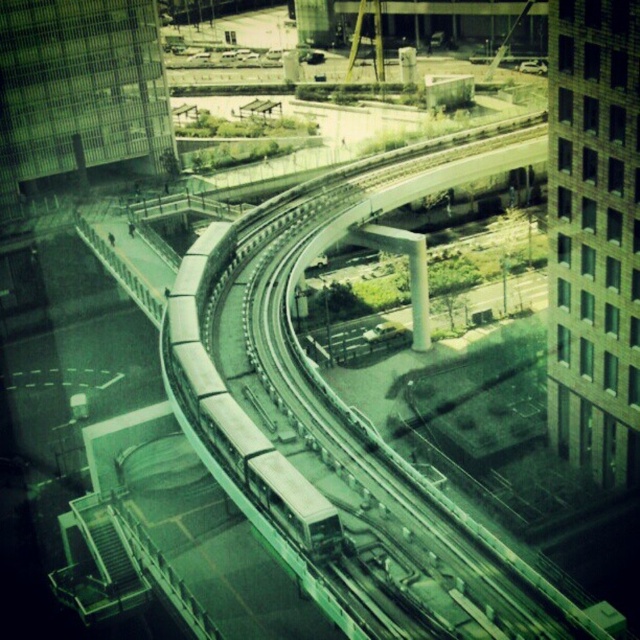
Question: Is the position of green concrete train track at center more distant than that of metallic silver train at center?

Choices:
 (A) no
 (B) yes

Answer: (A)

Question: Is green concrete train track at center to the right of metallic silver train at center from the viewer's perspective?

Choices:
 (A) yes
 (B) no

Answer: (A)

Question: Is green concrete train track at center to the left of metallic silver train at center from the viewer's perspective?

Choices:
 (A) yes
 (B) no

Answer: (B)

Question: Which point is closer to the camera?

Choices:
 (A) metallic silver train at center
 (B) green concrete train track at center

Answer: (B)

Question: Which point is farther to the camera?

Choices:
 (A) (209, 250)
 (B) (432, 596)

Answer: (A)